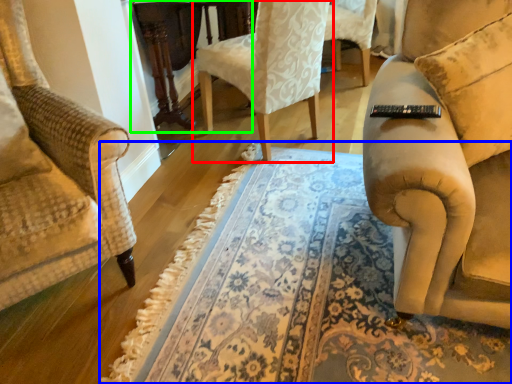
Question: Considering the real-world distances, which object is closest to chair (highlighted by a red box)? mat (highlighted by a blue box) or round table (highlighted by a green box).

Choices:
 (A) mat
 (B) round table

Answer: (B)